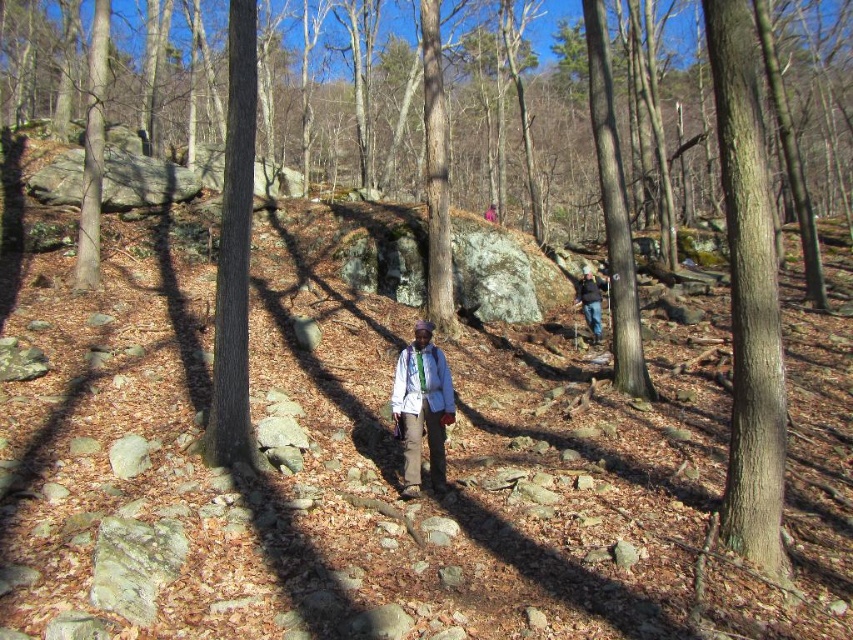
Does brown smooth tree trunk at right have a lesser height compared to matte gray backpack at center?

Incorrect, brown smooth tree trunk at right's height does not fall short of matte gray backpack at center's.

Find the location of a particular element. Image resolution: width=853 pixels, height=640 pixels. brown smooth tree trunk at right is located at coordinates (747, 301).

You are a GUI agent. You are given a task and a screenshot of the screen. Output one action in this format:
    pyautogui.click(x=<x>, y=<y>)
    Task: Click on the brown smooth tree trunk at right
    Image resolution: width=853 pixels, height=640 pixels.
    Given the screenshot: What is the action you would take?
    pyautogui.click(x=747, y=301)

Is smooth brown tree trunk at center thinner than dark blue jacket at upper right?

No.

Does point (235, 17) come behind point (601, 296)?

No, (235, 17) is closer to viewer.

Is point (231, 253) positioned after point (601, 333)?

That is False.

The image size is (853, 640). I want to click on smooth brown tree trunk at center, so click(x=234, y=252).

Is point (430, 381) positioned after point (489, 218)?

No, it is in front of (489, 218).

Between light blue fabric jacket at center and matte gray backpack at center, which one is positioned lower?

light blue fabric jacket at center is lower down.

What do you see at coordinates (422, 406) in the screenshot?
I see `light blue fabric jacket at center` at bounding box center [422, 406].

At what (x,y) coordinates should I click in order to perform the action: click on light blue fabric jacket at center. Please return your answer as a coordinate pair (x, y). The image size is (853, 640). Looking at the image, I should click on (422, 406).